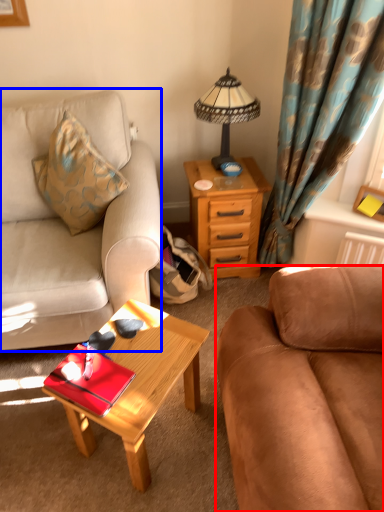
Question: Among these objects, which one is nearest to the camera, studio couch (highlighted by a red box) or studio couch (highlighted by a blue box)?

Choices:
 (A) studio couch
 (B) studio couch

Answer: (A)